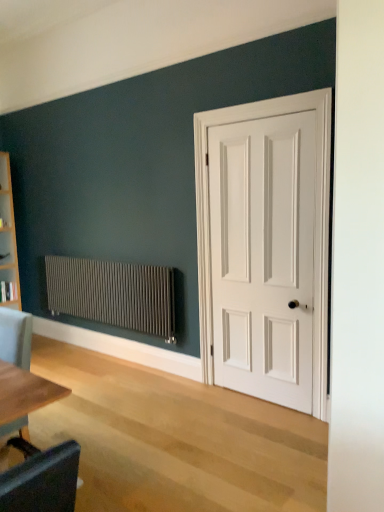
Find the location of a particular element. This screenshot has width=384, height=512. empty space that is ontop of white matte door at right (from a real-world perspective) is located at coordinates (254, 99).